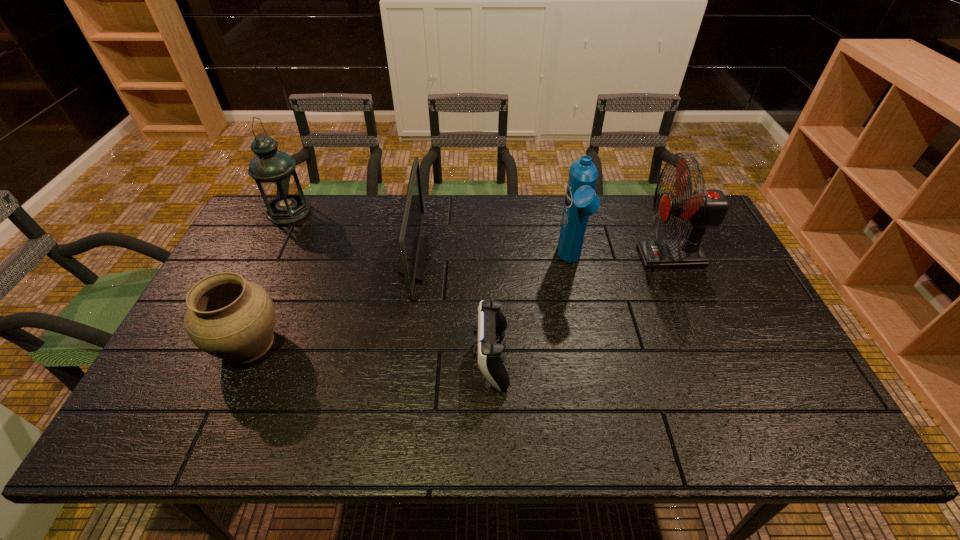
The width and height of the screenshot is (960, 540). I want to click on free region at the near left corner, so click(189, 442).

Image resolution: width=960 pixels, height=540 pixels. Identify the location of free space between the urn and the third object from right to left. (370, 350).

The height and width of the screenshot is (540, 960). Identify the location of vacant space that is in between the urn and the shampoo. (409, 302).

Where is `free space between the shampoo and the rightmost object`? free space between the shampoo and the rightmost object is located at coordinates (620, 259).

Identify the location of empty space that is in between the shortest object and the fifth object from left to right. This screenshot has height=540, width=960. (531, 310).

Identify the location of free area in between the rightmost object and the second object from right to left. (620, 259).

This screenshot has height=540, width=960. In order to click on free space between the oil lamp and the control in this screenshot , I will do `click(390, 285)`.

Identify the location of free spot between the oil lamp and the shampoo. (430, 237).

The width and height of the screenshot is (960, 540). In order to click on empty location between the urn and the shampoo in this screenshot , I will do `click(409, 302)`.

Where is `vacant space that is in between the oil lamp and the fan`? The width and height of the screenshot is (960, 540). vacant space that is in between the oil lamp and the fan is located at coordinates (480, 234).